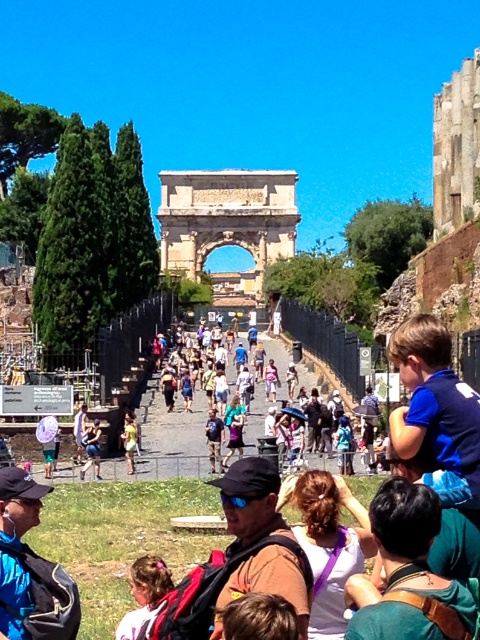
Describe the element at coordinates (327, 545) in the screenshot. I see `white fabric at center` at that location.

Does point (291, 490) come closer to viewer compared to point (96, 468)?

Yes, point (291, 490) is closer to viewer.

This screenshot has width=480, height=640. What do you see at coordinates (327, 545) in the screenshot?
I see `white fabric at center` at bounding box center [327, 545].

At what (x,y) coordinates should I click in order to perform the action: click on white fabric at center. Please return your answer as a coordinate pair (x, y). Image resolution: width=480 pixels, height=640 pixels. Looking at the image, I should click on (327, 545).

Is blue denim jeans at center above yellow fabric dress at center?

Yes, blue denim jeans at center is above yellow fabric dress at center.

Is point (235, 445) farther from camera compared to point (130, 458)?

Yes, it is.

The height and width of the screenshot is (640, 480). In order to click on blue denim jeans at center in this screenshot , I will do `click(233, 428)`.

Is the position of white fabric at center more distant than that of yellow fabric dress at center?

That is False.

Does white fabric at center have a greater height compared to yellow fabric dress at center?

Yes.

Between point (312, 538) and point (122, 436), which one is positioned behind?

The point (122, 436) is behind.

Locate an element on the screen. white fabric at center is located at coordinates click(327, 545).